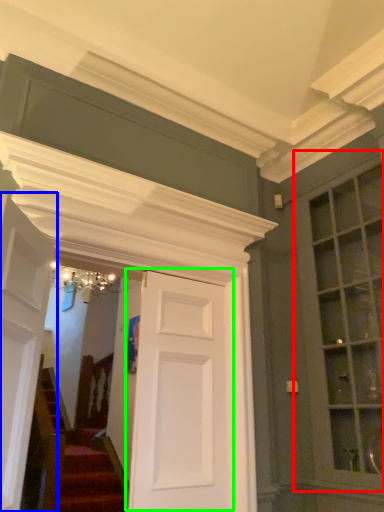
Question: Considering the real-world distances, which object is closest to window (highlighted by a red box)? door (highlighted by a blue box) or door (highlighted by a green box).

Choices:
 (A) door
 (B) door

Answer: (B)